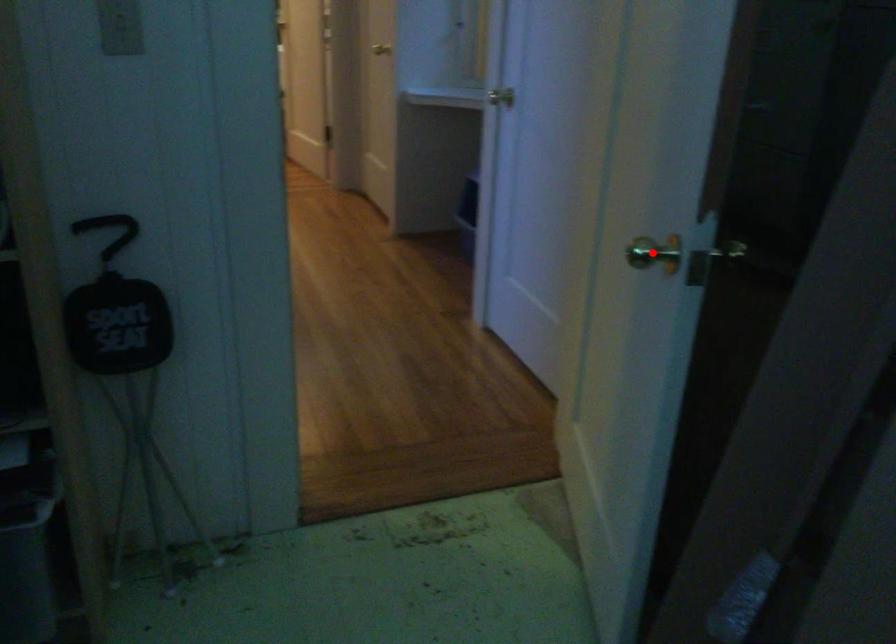
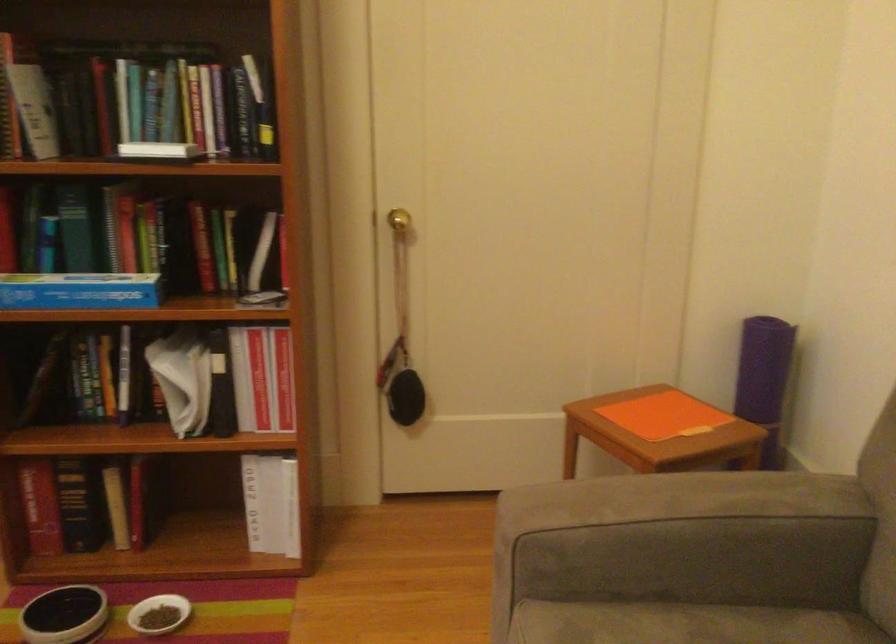
Question: I am providing you with two images of the same scene from different viewpoints. A red point is marked on the first image. Is the red point's position out of view in image 2?

Choices:
 (A) Yes
 (B) No

Answer: (A)